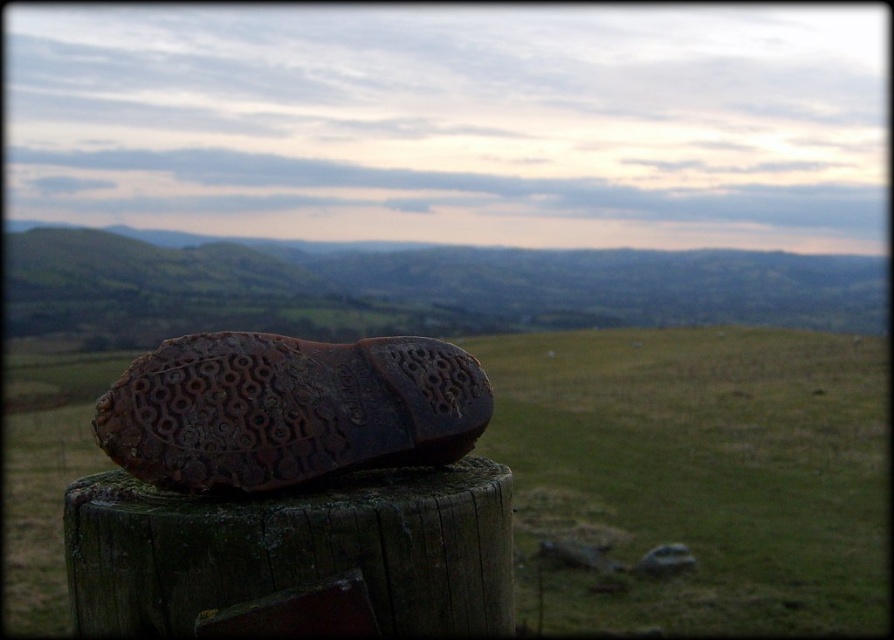
Does point (867, 406) come in front of point (268, 406)?

No.

Can you confirm if brown leather shoe at center is positioned to the right of brown rubber shoe at center?

Correct, you'll find brown leather shoe at center to the right of brown rubber shoe at center.

Which is in front, point (515, 403) or point (171, 484)?

Point (171, 484) is in front.

Where is `brown leather shoe at center`? The image size is (894, 640). brown leather shoe at center is located at coordinates (699, 474).